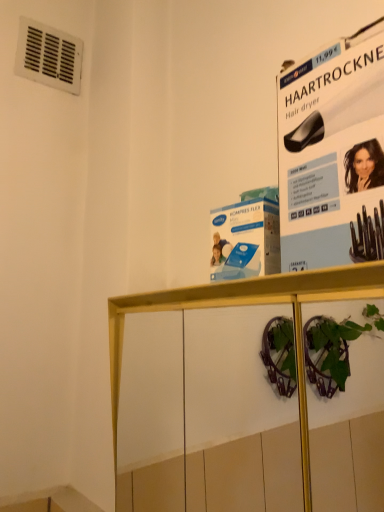
Question: Can you confirm if wooden shelf at center is positioned to the right of white paper at upper right?

Choices:
 (A) no
 (B) yes

Answer: (A)

Question: From the image's perspective, is wooden shelf at center located beneath white paper at upper right?

Choices:
 (A) yes
 (B) no

Answer: (A)

Question: Can you confirm if wooden shelf at center is taller than white paper at upper right?

Choices:
 (A) yes
 (B) no

Answer: (A)

Question: From the image's perspective, is wooden shelf at center over white paper at upper right?

Choices:
 (A) no
 (B) yes

Answer: (A)

Question: Can you confirm if wooden shelf at center is bigger than white paper at upper right?

Choices:
 (A) no
 (B) yes

Answer: (B)

Question: Would you say wooden shelf at center is a long distance from white paper at upper right?

Choices:
 (A) no
 (B) yes

Answer: (A)

Question: Can you confirm if white paper at upper right is bigger than white plastic vent at upper left?

Choices:
 (A) no
 (B) yes

Answer: (B)

Question: Does white paper at upper right turn towards white plastic vent at upper left?

Choices:
 (A) yes
 (B) no

Answer: (B)

Question: Is white paper at upper right outside of white plastic vent at upper left?

Choices:
 (A) yes
 (B) no

Answer: (A)

Question: Is white paper at upper right directly adjacent to white plastic vent at upper left?

Choices:
 (A) yes
 (B) no

Answer: (B)

Question: Considering the relative positions of white paper at upper right and white plastic vent at upper left in the image provided, is white paper at upper right to the right of white plastic vent at upper left from the viewer's perspective?

Choices:
 (A) no
 (B) yes

Answer: (B)

Question: From a real-world perspective, is white paper at upper right on top of white plastic vent at upper left?

Choices:
 (A) yes
 (B) no

Answer: (B)

Question: From a real-world perspective, is white plastic vent at upper left below white paper at upper right?

Choices:
 (A) no
 (B) yes

Answer: (A)